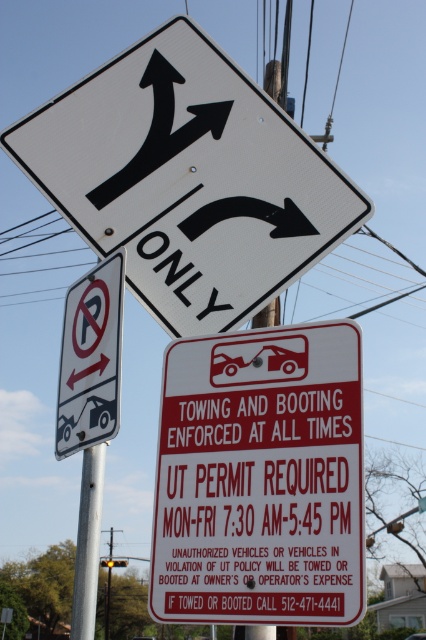
Question: Is white plastic no-parking sign at upper left to the left of metallic silver car at center from the viewer's perspective?

Choices:
 (A) yes
 (B) no

Answer: (A)

Question: From the image, what is the correct spatial relationship of red plastic sign at center in relation to white plastic no-parking sign at upper left?

Choices:
 (A) right
 (B) left

Answer: (A)

Question: Which object is positioned farthest from the red plastic sign at center?

Choices:
 (A) metallic silver car at center
 (B) white plastic no-parking sign at upper left

Answer: (A)

Question: Which object is closer to the camera taking this photo?

Choices:
 (A) silver metallic pole at center
 (B) white plastic sign at upper center
 (C) metallic silver car at center
 (D) red plastic sign at center

Answer: (D)

Question: Which point appears farthest from the camera in this image?

Choices:
 (A) (411, 632)
 (B) (114, 275)
 (C) (97, 528)
 (D) (198, 436)

Answer: (A)

Question: Does white plastic sign at upper center have a greater width compared to red plastic sign at center?

Choices:
 (A) no
 (B) yes

Answer: (B)